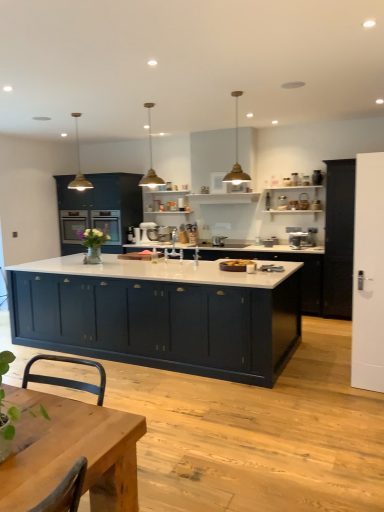
Question: Considering the positions of white matte stand mixer at center, the 2th appliance when ordered from front to back, and satin silver mixer at center, which is the second appliance from left to right, in the image, is white matte stand mixer at center, the 2th appliance when ordered from front to back, taller or shorter than satin silver mixer at center, which is the second appliance from left to right,?

Choices:
 (A) short
 (B) tall

Answer: (B)

Question: Is white matte stand mixer at center, the 2th appliance when ordered from front to back, spatially inside satin silver mixer at center, the second appliance in the back-to-front sequence, or outside of it?

Choices:
 (A) outside
 (B) inside

Answer: (A)

Question: Estimate the real-world distances between objects in this image. Which object is closer to the green leafy plant at lower left?

Choices:
 (A) satin silver toaster at center
 (B) white matte door at right
 (C) matte dark blue cabinet at center, which appears as the first cabinetry when viewed from the front
 (D) matte black cabinet at right, positioned as the 3th cabinetry in back-to-front order
 (E) white matte stand mixer at center, which appears as the 1th appliance when viewed from the left

Answer: (C)

Question: Which object is the farthest from the white matte door at right?

Choices:
 (A) matte blue cabinets at center, which is the 2th cabinetry from back to front
 (B) matte dark blue cabinets at center, the first cabinetry from the back
 (C) white matte stand mixer at center, which appears as the 1th appliance when viewed from the left
 (D) wooden table at center
 (E) green leafy plant at lower left

Answer: (B)